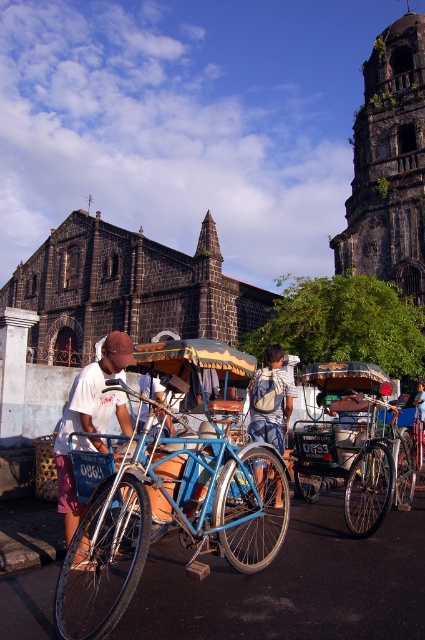
Can you confirm if metallic blue rickshaw at center is taller than matte black helmet at center?

Yes.

Is metallic blue rickshaw at center bigger than matte black helmet at center?

Yes.

This screenshot has width=425, height=640. What are the coordinates of `metallic blue rickshaw at center` in the screenshot? It's located at (348, 440).

At what (x,y) coordinates should I click in order to perform the action: click on metallic blue rickshaw at center. Please return your answer as a coordinate pair (x, y). Looking at the image, I should click on (348, 440).

Does point (396, 232) lie in front of point (283, 400)?

No, (396, 232) is behind (283, 400).

Can you confirm if dark stone tower at upper right is thinner than blue denim shorts at center?

Incorrect, dark stone tower at upper right's width is not less than blue denim shorts at center's.

Does point (374, 259) come closer to viewer compared to point (257, 385)?

That is False.

This screenshot has width=425, height=640. What are the coordinates of `dark stone tower at upper right` in the screenshot? It's located at (x=388, y=164).

Can you confirm if dark stone tower at upper right is shorter than brushed metal bicycle at left?

Incorrect, dark stone tower at upper right's height does not fall short of brushed metal bicycle at left's.

Is dark stone tower at upper right taller than brushed metal bicycle at left?

Indeed, dark stone tower at upper right has a greater height compared to brushed metal bicycle at left.

Locate an element on the screen. The height and width of the screenshot is (640, 425). dark stone tower at upper right is located at coordinates (388, 164).

I want to click on dark stone tower at upper right, so click(388, 164).